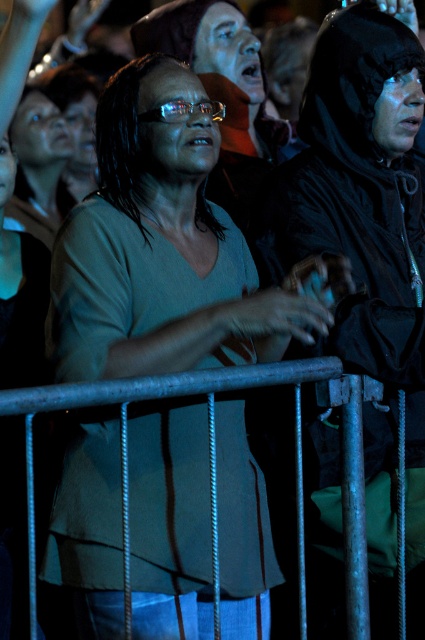
Question: Among these objects, which one is nearest to the camera?

Choices:
 (A) metallic gray rail at center
 (B) matte green shirt at center

Answer: (A)

Question: Which object is closer to the camera taking this photo?

Choices:
 (A) metallic gray rail at center
 (B) matte green shirt at center

Answer: (A)

Question: Is matte green shirt at center thinner than metallic gray rail at center?

Choices:
 (A) no
 (B) yes

Answer: (B)

Question: Does matte green shirt at center lie in front of metallic gray rail at center?

Choices:
 (A) yes
 (B) no

Answer: (B)

Question: Is matte green shirt at center smaller than metallic gray rail at center?

Choices:
 (A) no
 (B) yes

Answer: (A)